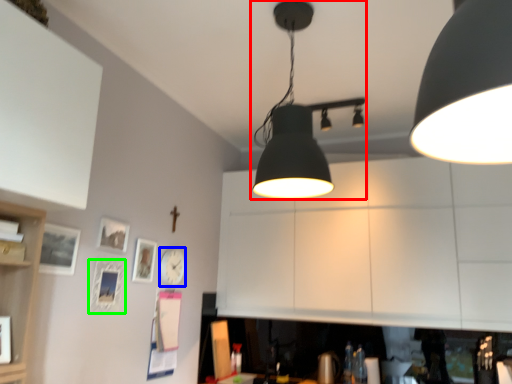
Question: Which object is positioned farthest from lamp (highlighted by a red box)? Select from clock (highlighted by a blue box) and picture frame (highlighted by a green box).

Choices:
 (A) clock
 (B) picture frame

Answer: (A)